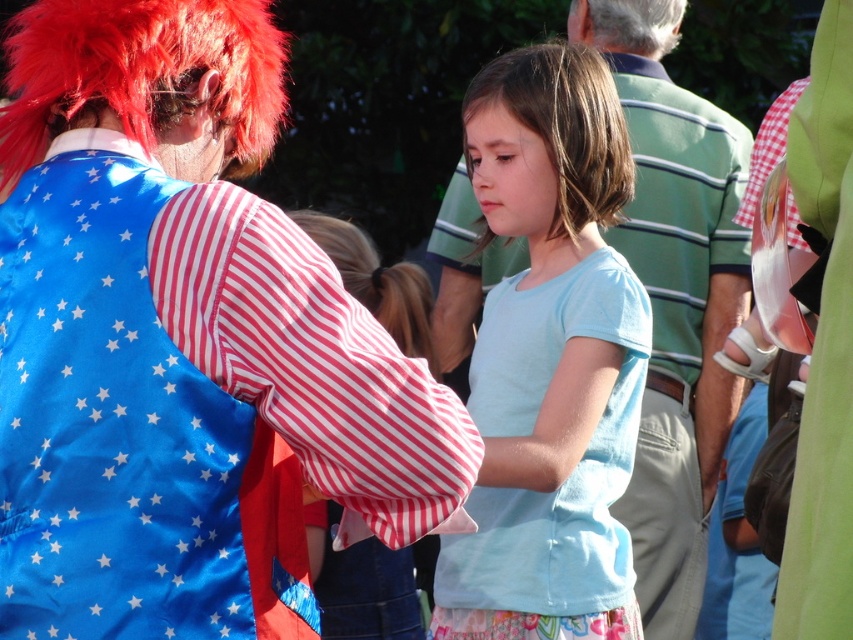
Between blue satin vest at left and light blue cotton dress at center, which one has more height?

light blue cotton dress at center

Is blue satin vest at left smaller than light blue cotton dress at center?

Correct, blue satin vest at left occupies less space than light blue cotton dress at center.

Which is behind, point (219, 483) or point (589, 513)?

The point (589, 513) is more distant.

In order to click on blue satin vest at left in this screenshot , I will do `click(190, 404)`.

Is green striped shirt at center to the right of fluffy red wig at upper left from the viewer's perspective?

Yes, green striped shirt at center is to the right of fluffy red wig at upper left.

This screenshot has height=640, width=853. What do you see at coordinates (680, 324) in the screenshot?
I see `green striped shirt at center` at bounding box center [680, 324].

Is point (486, 273) in front of point (234, 154)?

No, (486, 273) is behind (234, 154).

Where is `green striped shirt at center`? The height and width of the screenshot is (640, 853). green striped shirt at center is located at coordinates (680, 324).

Does light blue cotton dress at center have a lesser width compared to fluffy red wig at upper left?

No, light blue cotton dress at center is not thinner than fluffy red wig at upper left.

How distant is light blue cotton dress at center from fluffy red wig at upper left?

light blue cotton dress at center and fluffy red wig at upper left are 1.20 meters apart from each other.

Between point (618, 589) and point (189, 28), which one is positioned in front?

Point (189, 28)

You are a GUI agent. You are given a task and a screenshot of the screen. Output one action in this format:
    pyautogui.click(x=<x>, y=<y>)
    Task: Click on the light blue cotton dress at center
    This screenshot has width=853, height=640.
    Given the screenshot: What is the action you would take?
    pyautogui.click(x=556, y=468)